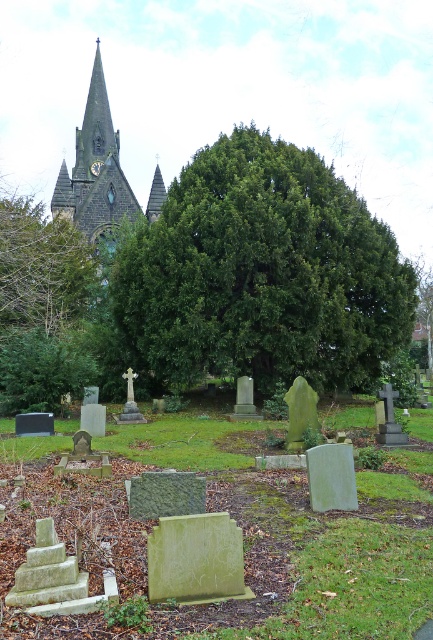
Does green leafy tree at center appear on the right side of dark gray stone spire at upper center?

Correct, you'll find green leafy tree at center to the right of dark gray stone spire at upper center.

Which is in front, point (277, 204) or point (155, 216)?

Point (277, 204)

Where is `green leafy tree at center`? The height and width of the screenshot is (640, 433). green leafy tree at center is located at coordinates (261, 273).

Looking at this image, which is more to the right, green leafy tree at center or smooth stone church steeple at upper left?

green leafy tree at center

Between green leafy tree at center and smooth stone church steeple at upper left, which one has less height?

green leafy tree at center is shorter.

The image size is (433, 640). In order to click on green leafy tree at center in this screenshot , I will do `click(261, 273)`.

Can you confirm if green leafy tree at upper left is positioned above dark gray stone spire at upper center?

No, green leafy tree at upper left is not above dark gray stone spire at upper center.

Is green leafy tree at upper left to the right of dark gray stone spire at upper center from the viewer's perspective?

In fact, green leafy tree at upper left is to the left of dark gray stone spire at upper center.

Which is in front, point (13, 260) or point (155, 211)?

Positioned in front is point (13, 260).

Where is `green leafy tree at upper left`? This screenshot has width=433, height=640. green leafy tree at upper left is located at coordinates (42, 269).